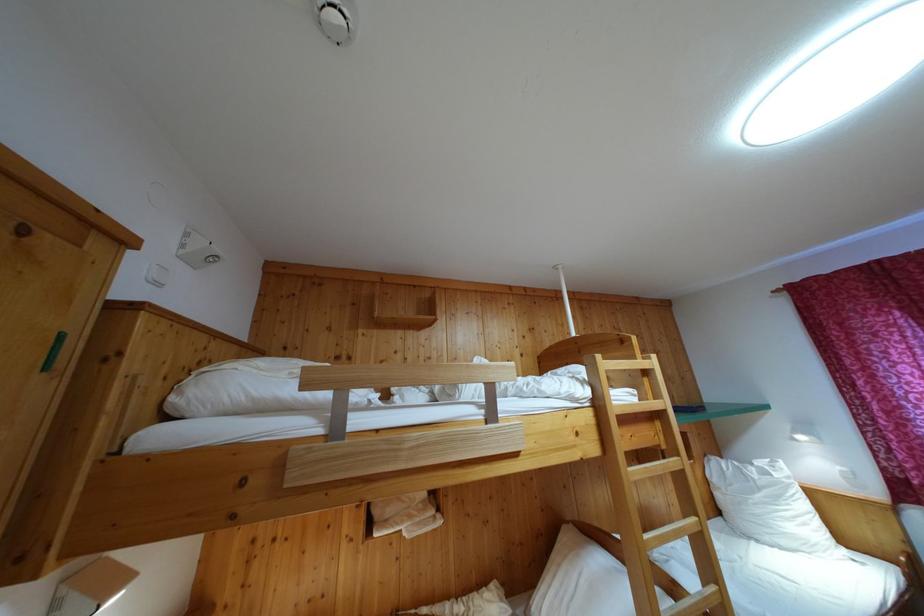
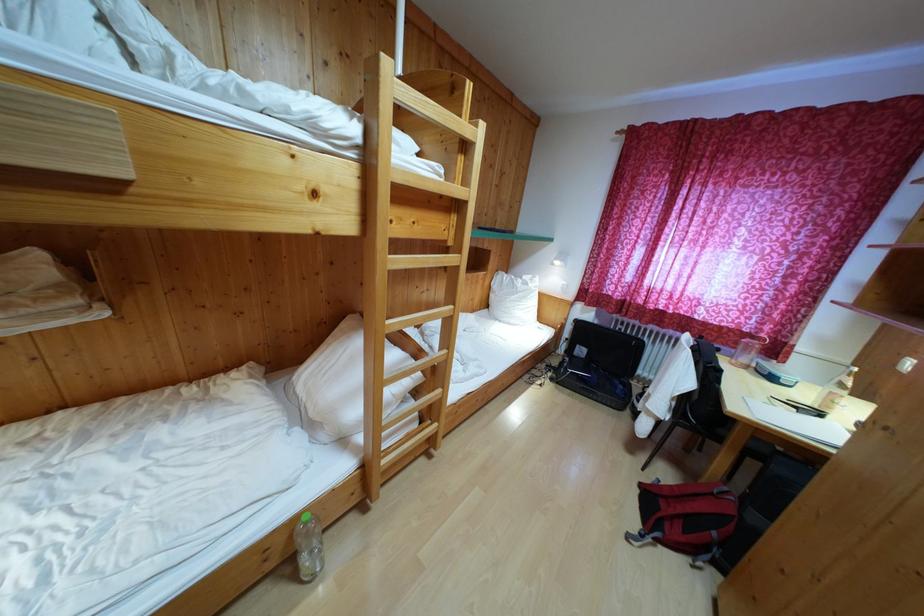
The images are taken continuously from a first-person perspective. In which direction is your viewpoint rotating?

The camera's rotation is toward right-down.